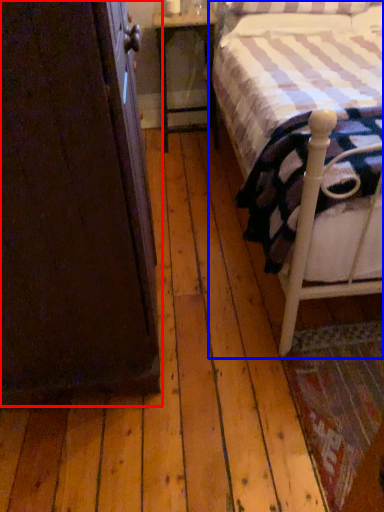
Question: Which of the following is the farthest to the observer, armoire (highlighted by a red box) or bed (highlighted by a blue box)?

Choices:
 (A) armoire
 (B) bed

Answer: (B)